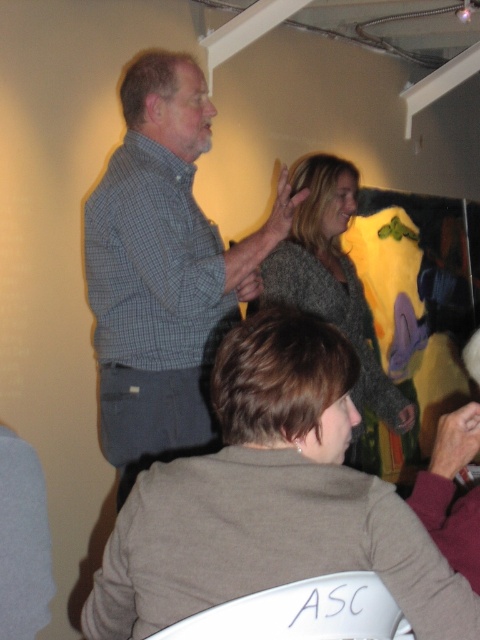
You are standing at point (232, 278) and want to move to point (330, 385). Is there any obstruction between you and your destination?

Point (330, 385) is in front of point (232, 278), so there is no obstruction between them.

You are standing in the room and want to reach the point at coordinates point (420, 548). The space between you and the point is 38.86 inches. Can you walk straight to it without any obstacles?

The distance between you and the point (420, 548) is 38.86 inches, so you can walk straight to it as there are no obstacles mentioned in the scene description.